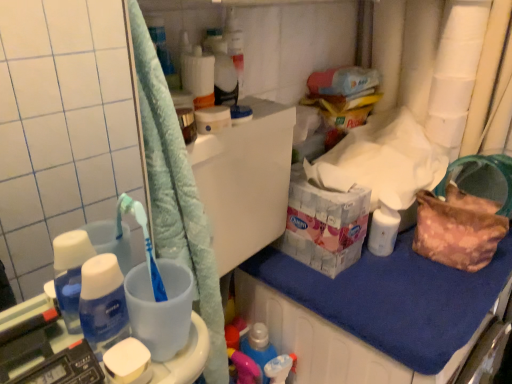
Question: From a real-world perspective, is white matte soap at lower left physically below white matte toilet paper at upper right?

Choices:
 (A) no
 (B) yes

Answer: (B)

Question: Is white matte soap at lower left wider than white matte toilet paper at upper right?

Choices:
 (A) yes
 (B) no

Answer: (B)

Question: Can you confirm if white matte soap at lower left is bigger than white matte toilet paper at upper right?

Choices:
 (A) no
 (B) yes

Answer: (A)

Question: Can you confirm if white matte soap at lower left is taller than white matte toilet paper at upper right?

Choices:
 (A) yes
 (B) no

Answer: (B)

Question: Are white matte soap at lower left and white matte toilet paper at upper right located far from each other?

Choices:
 (A) yes
 (B) no

Answer: (A)

Question: Is white matte soap at lower left located outside white matte toilet paper at upper right?

Choices:
 (A) yes
 (B) no

Answer: (A)

Question: Is black plastic scale at lower left aimed at white glossy bottle at right?

Choices:
 (A) yes
 (B) no

Answer: (B)

Question: Can you confirm if black plastic scale at lower left is thinner than white glossy bottle at right?

Choices:
 (A) yes
 (B) no

Answer: (A)

Question: Is black plastic scale at lower left wider than white glossy bottle at right?

Choices:
 (A) yes
 (B) no

Answer: (B)

Question: Is the position of black plastic scale at lower left less distant than that of white glossy bottle at right?

Choices:
 (A) yes
 (B) no

Answer: (A)

Question: From a real-world perspective, is black plastic scale at lower left located higher than white glossy bottle at right?

Choices:
 (A) no
 (B) yes

Answer: (B)

Question: Does black plastic scale at lower left appear on the right side of white glossy bottle at right?

Choices:
 (A) yes
 (B) no

Answer: (B)

Question: Does black plastic scale at lower left have a lesser height compared to white matte toilet paper at upper right?

Choices:
 (A) yes
 (B) no

Answer: (A)